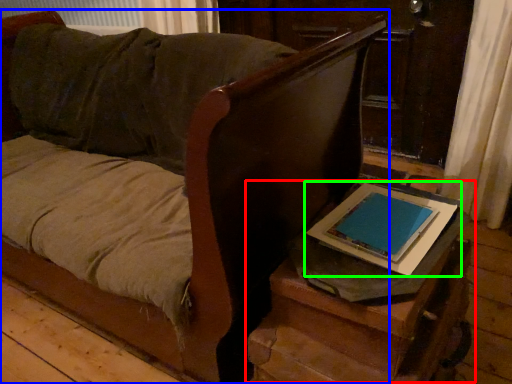
Question: Which is nearer to the table (highlighted by a red box)? furniture (highlighted by a blue box) or tablet computer (highlighted by a green box).

Choices:
 (A) furniture
 (B) tablet computer

Answer: (B)